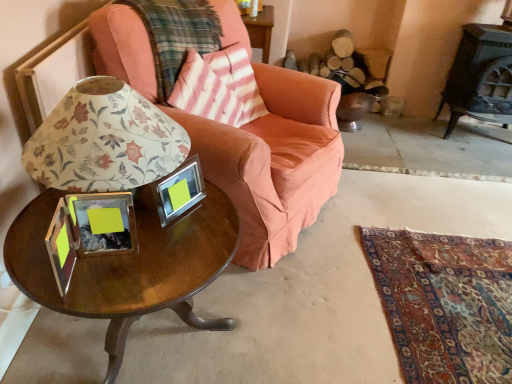
Question: Considering the relative positions of clear glass picture frame at center and matte pink fabric chair at center in the image provided, is clear glass picture frame at center to the right of matte pink fabric chair at center from the viewer's perspective?

Choices:
 (A) yes
 (B) no

Answer: (B)

Question: Is clear glass picture frame at center aimed at matte pink fabric chair at center?

Choices:
 (A) no
 (B) yes

Answer: (A)

Question: Is clear glass picture frame at center closer to the viewer compared to matte pink fabric chair at center?

Choices:
 (A) yes
 (B) no

Answer: (A)

Question: From the image's perspective, does clear glass picture frame at center appear lower than matte pink fabric chair at center?

Choices:
 (A) yes
 (B) no

Answer: (A)

Question: Is clear glass picture frame at center smaller than matte pink fabric chair at center?

Choices:
 (A) no
 (B) yes

Answer: (B)

Question: Is clear glass picture frame at center not inside matte pink fabric chair at center?

Choices:
 (A) yes
 (B) no

Answer: (A)

Question: Is velvet orange swivel chair at center oriented towards matte pink fabric chair at center?

Choices:
 (A) yes
 (B) no

Answer: (B)

Question: Can you confirm if velvet orange swivel chair at center is wider than matte pink fabric chair at center?

Choices:
 (A) no
 (B) yes

Answer: (A)

Question: Is velvet orange swivel chair at center positioned beyond the bounds of matte pink fabric chair at center?

Choices:
 (A) yes
 (B) no

Answer: (A)

Question: Is velvet orange swivel chair at center positioned behind matte pink fabric chair at center?

Choices:
 (A) no
 (B) yes

Answer: (B)

Question: Is velvet orange swivel chair at center at the left side of matte pink fabric chair at center?

Choices:
 (A) yes
 (B) no

Answer: (B)

Question: Is matte pink fabric chair at center a part of velvet orange swivel chair at center?

Choices:
 (A) yes
 (B) no

Answer: (B)

Question: Considering the relative sizes of pink striped fabric pillow at upper center and floral paper lampshade at center in the image provided, is pink striped fabric pillow at upper center shorter than floral paper lampshade at center?

Choices:
 (A) no
 (B) yes

Answer: (B)